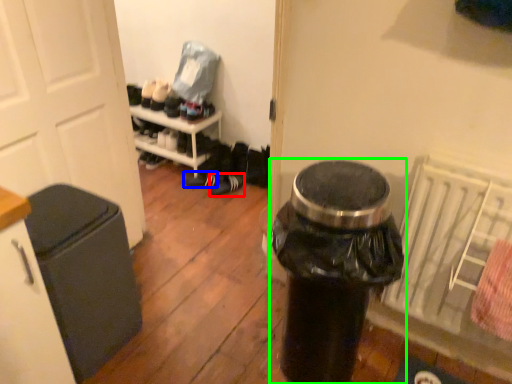
Question: Which object is the closest to the footwear (highlighted by a red box)? Choose among these: footwear (highlighted by a blue box) or waste container (highlighted by a green box).

Choices:
 (A) footwear
 (B) waste container

Answer: (A)